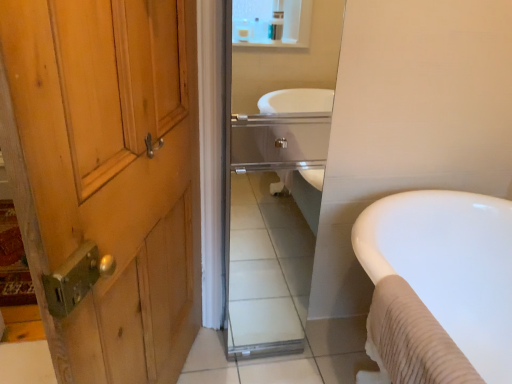
Question: In terms of width, does white glossy bathtub at right look wider or thinner when compared to glossy glass mirror at center?

Choices:
 (A) wide
 (B) thin

Answer: (A)

Question: Is white glossy bathtub at right spatially inside glossy glass mirror at center, or outside of it?

Choices:
 (A) inside
 (B) outside

Answer: (B)

Question: In the image, is white glossy bathtub at right positioned in front of or behind glossy glass mirror at center?

Choices:
 (A) behind
 (B) front

Answer: (B)

Question: From a real-world perspective, is glossy glass mirror at center above or below white glossy bathtub at right?

Choices:
 (A) above
 (B) below

Answer: (A)

Question: In terms of width, does glossy glass mirror at center look wider or thinner when compared to white glossy bathtub at right?

Choices:
 (A) thin
 (B) wide

Answer: (A)

Question: Is glossy glass mirror at center in front of or behind white glossy bathtub at right in the image?

Choices:
 (A) front
 (B) behind

Answer: (B)

Question: Visually, is glossy glass mirror at center positioned to the left or to the right of white glossy bathtub at right?

Choices:
 (A) right
 (B) left

Answer: (B)